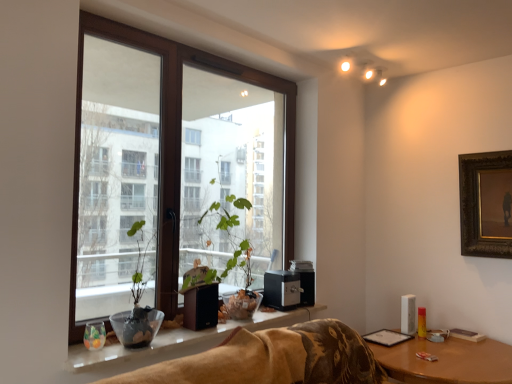
Question: Does white glossy window sill at lower center turn towards gold-framed painting at upper right?

Choices:
 (A) yes
 (B) no

Answer: (B)

Question: Can you confirm if white glossy window sill at lower center is positioned to the left of gold-framed painting at upper right?

Choices:
 (A) yes
 (B) no

Answer: (A)

Question: Is white glossy window sill at lower center in front of gold-framed painting at upper right?

Choices:
 (A) yes
 (B) no

Answer: (A)

Question: Is white glossy window sill at lower center smaller than gold-framed painting at upper right?

Choices:
 (A) no
 (B) yes

Answer: (B)

Question: Is gold-framed painting at upper right at the back of white glossy window sill at lower center?

Choices:
 (A) yes
 (B) no

Answer: (B)

Question: Is white glossy window sill at lower center not within gold-framed painting at upper right?

Choices:
 (A) yes
 (B) no

Answer: (A)

Question: From the image's perspective, would you say brown wooden table at lower right is positioned over gold-framed painting at upper right?

Choices:
 (A) no
 (B) yes

Answer: (A)

Question: Could gold-framed painting at upper right be considered to be inside brown wooden table at lower right?

Choices:
 (A) yes
 (B) no

Answer: (B)

Question: Is brown wooden table at lower right oriented towards gold-framed painting at upper right?

Choices:
 (A) yes
 (B) no

Answer: (B)

Question: Can you confirm if brown wooden table at lower right is positioned to the right of gold-framed painting at upper right?

Choices:
 (A) yes
 (B) no

Answer: (B)

Question: Is brown wooden table at lower right not close to gold-framed painting at upper right?

Choices:
 (A) no
 (B) yes

Answer: (A)

Question: From a real-world perspective, is brown wooden table at lower right positioned over gold-framed painting at upper right based on gravity?

Choices:
 (A) no
 (B) yes

Answer: (A)

Question: Is the surface of white glossy window sill at lower center in direct contact with brown wooden table at lower right?

Choices:
 (A) yes
 (B) no

Answer: (B)